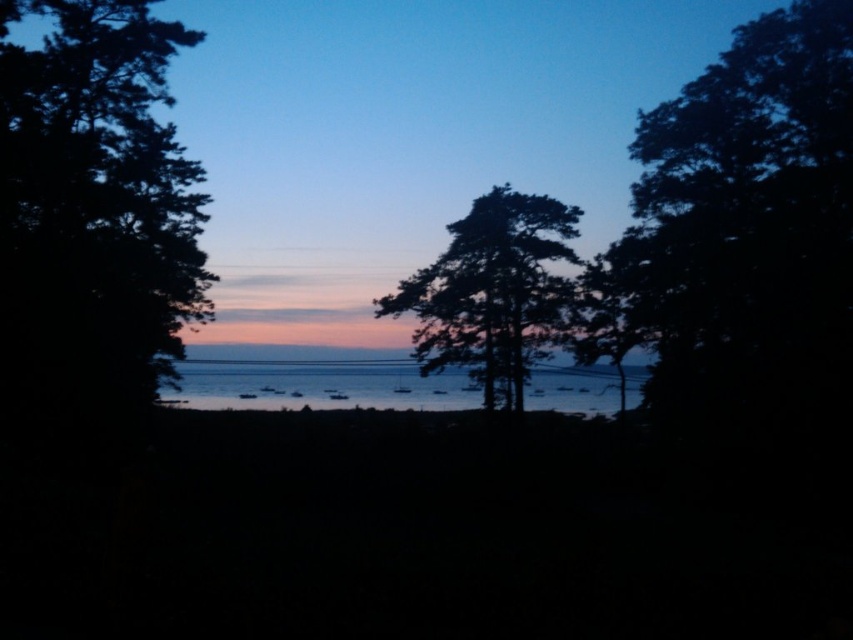
Which is more to the left, dark green leafy tree at left or silvery reflective water at center?

From the viewer's perspective, dark green leafy tree at left appears more on the left side.

Is dark green leafy tree at left closer to camera compared to silvery reflective water at center?

Yes, dark green leafy tree at left is in front of silvery reflective water at center.

Identify the location of dark green leafy tree at left. (93, 212).

Who is shorter, silhouette wood tree at center or silvery reflective water at center?

silvery reflective water at center is shorter.

Can you confirm if silhouette wood tree at center is wider than silvery reflective water at center?

Incorrect, silhouette wood tree at center's width does not surpass silvery reflective water at center's.

This screenshot has height=640, width=853. What do you see at coordinates (492, 292) in the screenshot? I see `silhouette wood tree at center` at bounding box center [492, 292].

At what (x,y) coordinates should I click in order to perform the action: click on silhouette wood tree at center. Please return your answer as a coordinate pair (x, y). The image size is (853, 640). Looking at the image, I should click on (492, 292).

Does dark green leafy tree at left have a smaller size compared to silhouette wood tree at center?

Yes, dark green leafy tree at left is smaller than silhouette wood tree at center.

Is point (41, 348) more distant than point (489, 273)?

No, it is in front of (489, 273).

This screenshot has width=853, height=640. What do you see at coordinates (93, 212) in the screenshot? I see `dark green leafy tree at left` at bounding box center [93, 212].

Identify the location of dark green leafy tree at left. click(x=93, y=212).